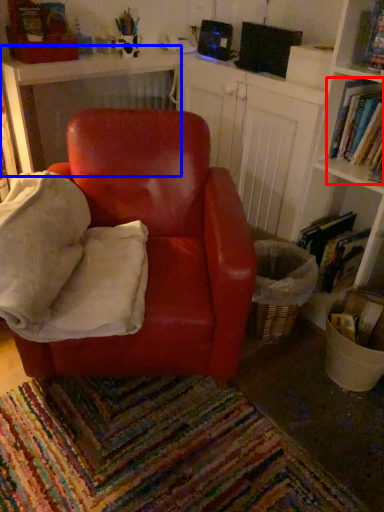
Question: Among these objects, which one is nearest to the camera, book (highlighted by a red box) or table (highlighted by a blue box)?

Choices:
 (A) book
 (B) table

Answer: (A)